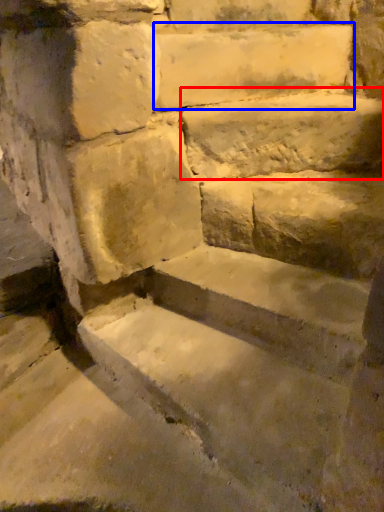
Question: Among these objects, which one is nearest to the camera, limestone (highlighted by a red box) or limestone (highlighted by a blue box)?

Choices:
 (A) limestone
 (B) limestone

Answer: (A)